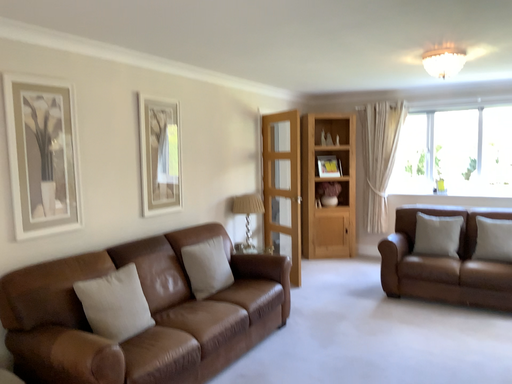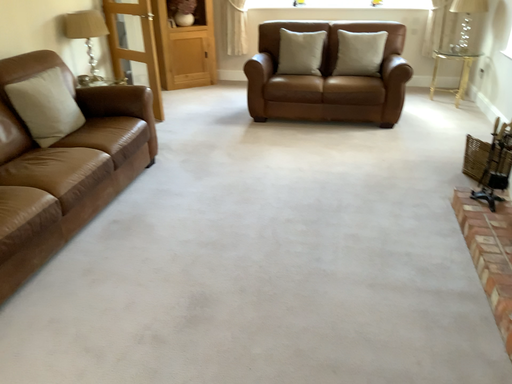
Question: How did the camera likely rotate when shooting the video?

Choices:
 (A) rotated left
 (B) rotated right

Answer: (B)